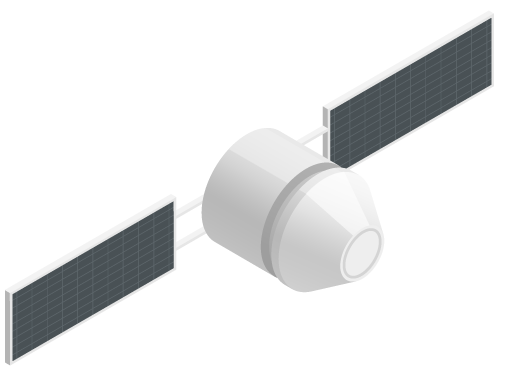
At what (x,y) coordinates should I click in order to perform the action: click on panel. Please return your answer as a coordinate pair (x, y). Looking at the image, I should click on (388, 122), (140, 234).